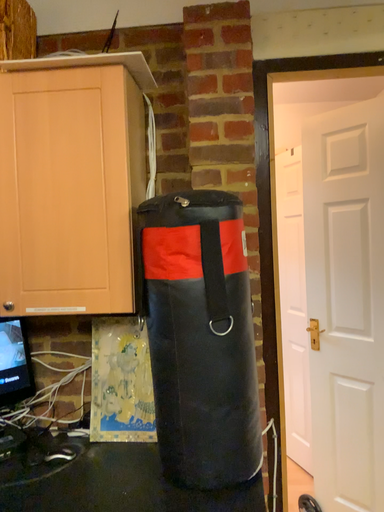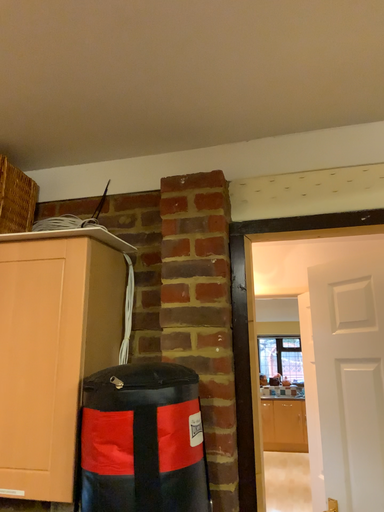
Question: Which way did the camera rotate in the video?

Choices:
 (A) rotated upward
 (B) rotated downward

Answer: (A)